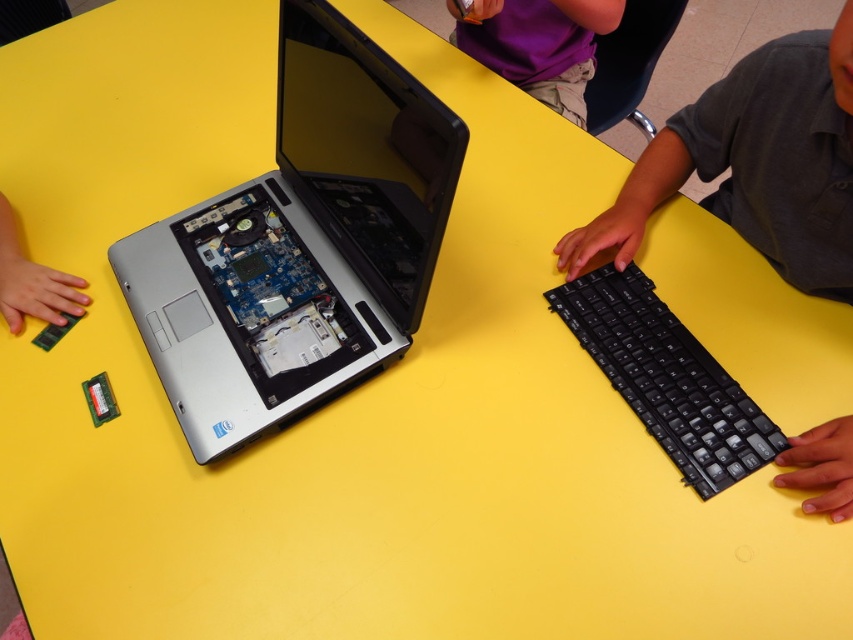
Question: Does silver metallic laptop at center come in front of black plastic keyboard at right?

Choices:
 (A) no
 (B) yes

Answer: (B)

Question: Which object appears farthest from the camera in this image?

Choices:
 (A) silver metallic laptop at center
 (B) purple fabric shirt at upper center
 (C) black matte keyboard at right
 (D) black plastic keyboard at right

Answer: (B)

Question: Which of the following is the closest to the observer?

Choices:
 (A) silver metallic laptop at center
 (B) purple fabric shirt at upper center

Answer: (A)

Question: Is silver metallic laptop at center smaller than black matte keyboard at right?

Choices:
 (A) yes
 (B) no

Answer: (B)

Question: Is silver metallic laptop at center further to the viewer compared to black plastic keyboard at right?

Choices:
 (A) yes
 (B) no

Answer: (B)

Question: Which point appears farthest from the camera in this image?

Choices:
 (A) (706, 141)
 (B) (318, 273)

Answer: (A)